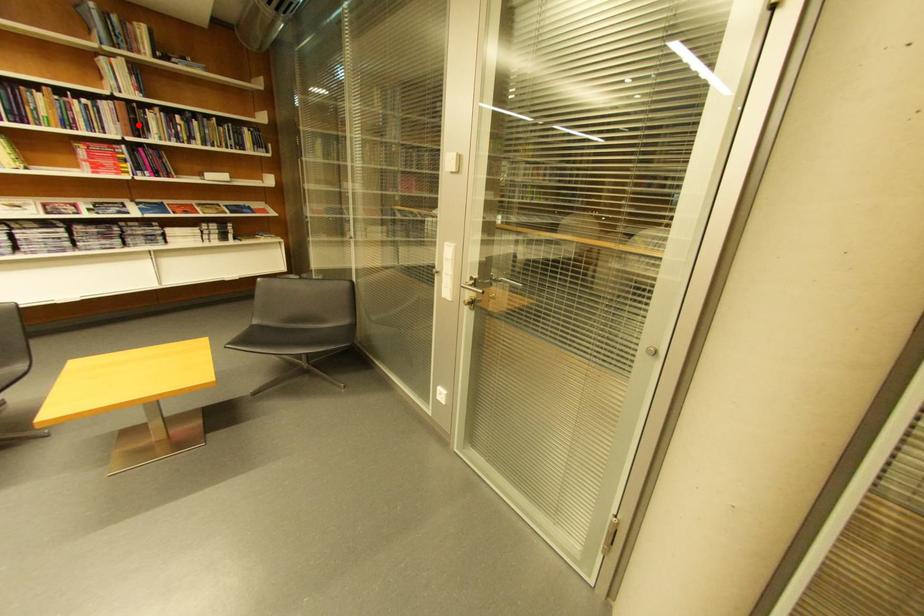
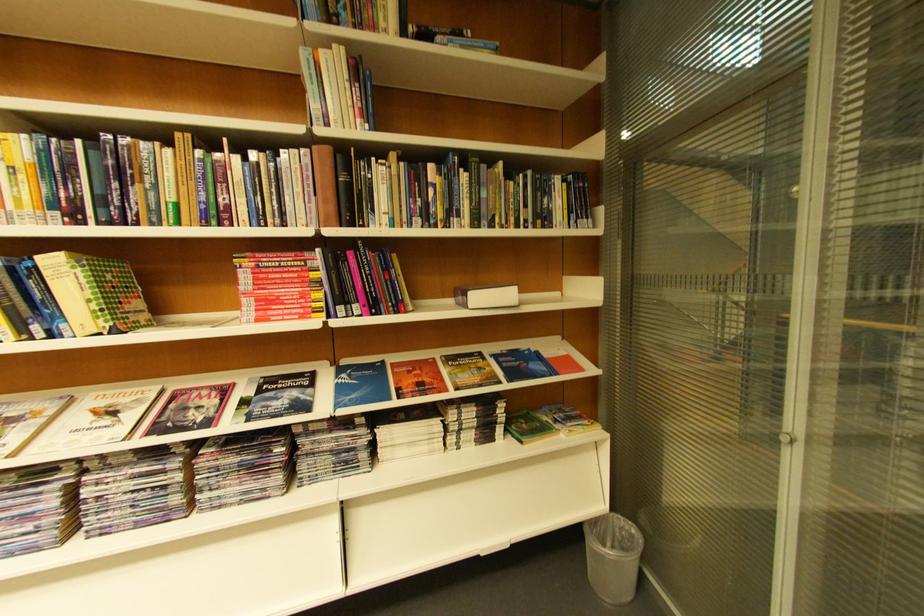
Question: I am providing you with two images of the same scene from different viewpoints. A red point is shown in image1. For the corresponding object point in image2, is it positioned nearer or farther from the camera?

Choices:
 (A) Nearer
 (B) Farther

Answer: (A)